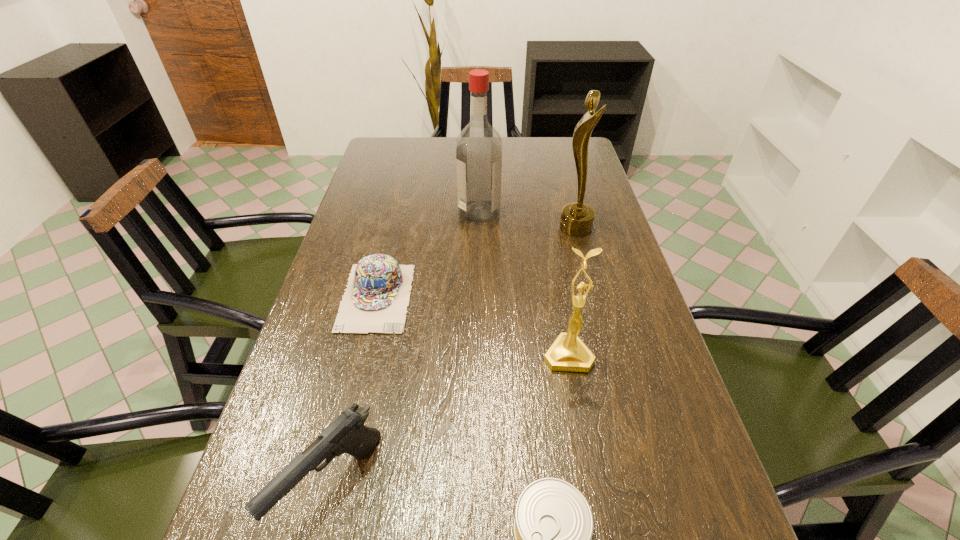
Where is `vacant space situated 0.160m on the front-facing side of the nearer award`? Image resolution: width=960 pixels, height=540 pixels. vacant space situated 0.160m on the front-facing side of the nearer award is located at coordinates (x=585, y=447).

Locate an element on the screen. free space located on the front, side, and top of the second shortest object is located at coordinates click(x=349, y=410).

This screenshot has width=960, height=540. What are the coordinates of `object located in the left edge section of the desktop` in the screenshot? It's located at (377, 295).

At what (x,y) coordinates should I click in order to perform the action: click on vacant region at the far edge of the desktop. Please return your answer as a coordinate pair (x, y). This screenshot has height=540, width=960. Looking at the image, I should click on (416, 165).

Locate an element on the screen. vacant area at the left edge of the desktop is located at coordinates (398, 172).

You are a GUI agent. You are given a task and a screenshot of the screen. Output one action in this format:
    pyautogui.click(x=<x>, y=<y>)
    Task: Click on the free spot at the right edge of the desktop
    
    Given the screenshot: What is the action you would take?
    pyautogui.click(x=614, y=406)

Where is `vacant position at the far left corner of the desktop`? vacant position at the far left corner of the desktop is located at coordinates (396, 141).

Find the location of a particular element. Image resolution: width=960 pixels, height=540 pixels. blank space at the far right corner of the desktop is located at coordinates (544, 149).

Locate an element on the screen. The width and height of the screenshot is (960, 540). vacant region between the cap and the taller award is located at coordinates (476, 262).

What are the coordinates of `the closest object to the liquor` in the screenshot? It's located at (577, 218).